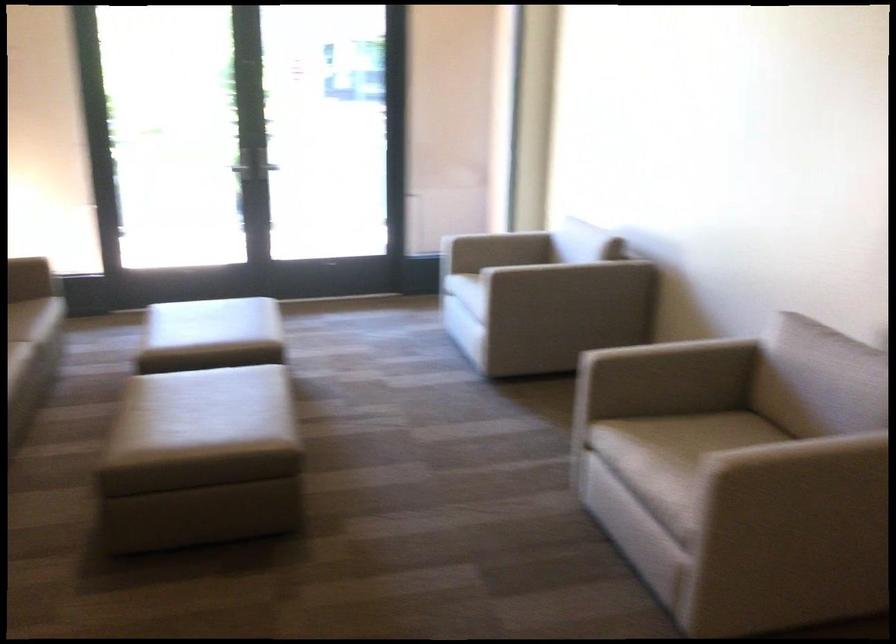
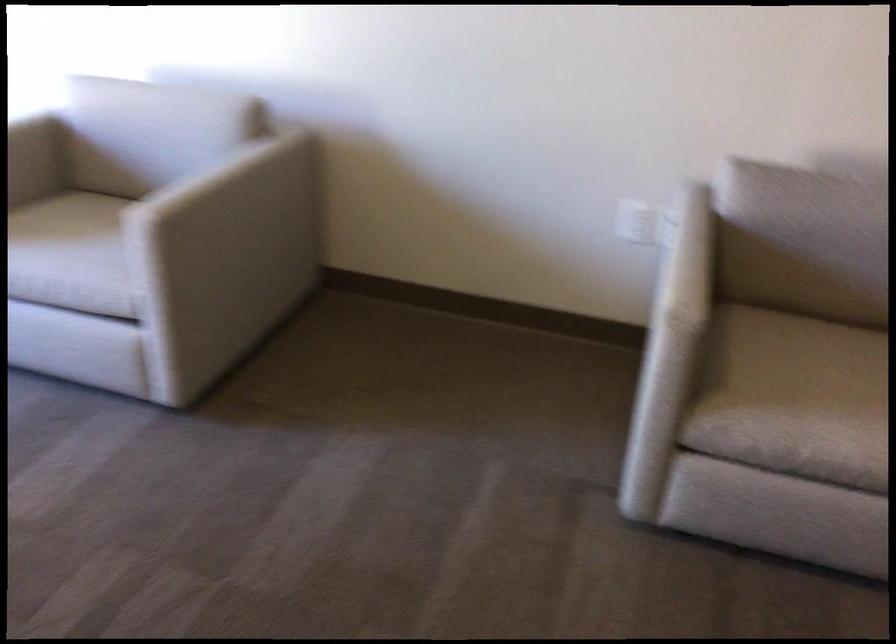
The point at [720,451] is marked in the first image. Where is the corresponding point in the second image?

(819, 361)